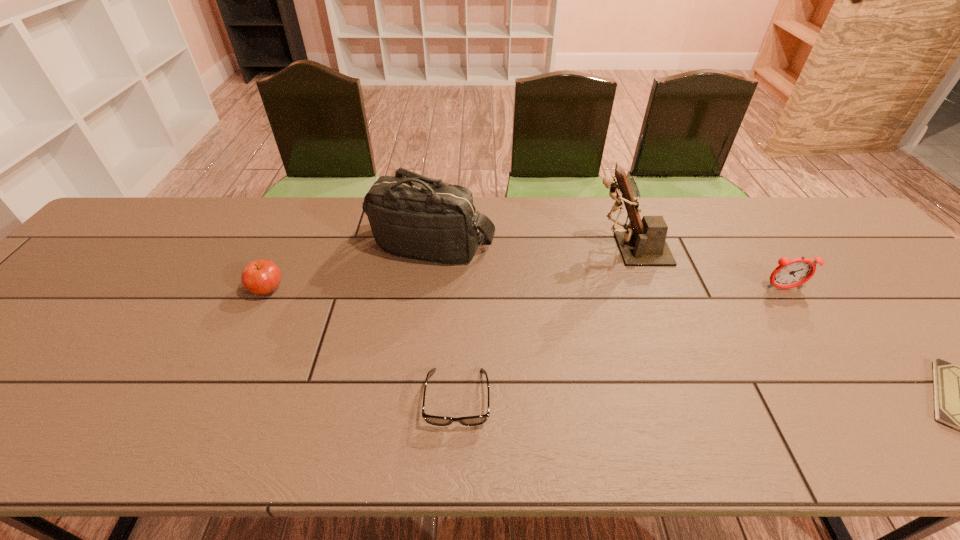
The image size is (960, 540). I want to click on vacant space at the far right corner of the desktop, so click(x=845, y=240).

The width and height of the screenshot is (960, 540). Find the location of `free space between the leftmost object and the third tallest object`. free space between the leftmost object and the third tallest object is located at coordinates (525, 289).

Identify the location of vacant area that lies between the spectacles and the leftmost object. (363, 345).

What are the coordinates of `unoccupied position between the apple and the third tallest object` in the screenshot? It's located at (525, 289).

The width and height of the screenshot is (960, 540). I want to click on vacant space that is in between the third object from right to left and the alarm clock, so click(706, 269).

You are a GUI agent. You are given a task and a screenshot of the screen. Output one action in this format:
    pyautogui.click(x=<x>, y=<y>)
    Task: Click on the free space between the fifth tallest object and the apple
    The width and height of the screenshot is (960, 540).
    Given the screenshot: What is the action you would take?
    pyautogui.click(x=363, y=345)

This screenshot has height=540, width=960. In order to click on free space between the fourth shortest object and the shoulder bag in this screenshot , I will do `click(608, 268)`.

Find the location of a particular element. This screenshot has height=540, width=960. object identified as the second closest to the second shortest object is located at coordinates click(x=261, y=277).

Locate which object is the fourth closest to the second object from right to left. Please provide its 2D coordinates. Your answer should be formatted as a tuple, i.e. [(x, y)], where the tuple contains the x and y coordinates of a point satisfying the conditions above.

[(430, 419)]